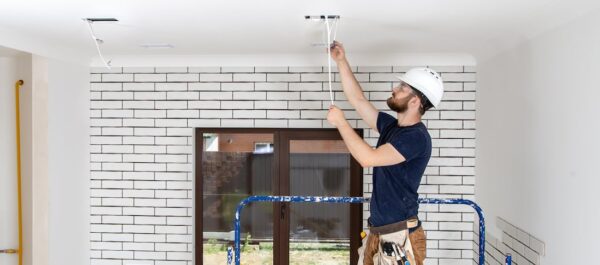
At what (x,y) coordinates should I click in order to perform the action: click on white brick. Please return your answer as a coordinate pair (x, y). The width and height of the screenshot is (600, 265). Looking at the image, I should click on (157, 174).